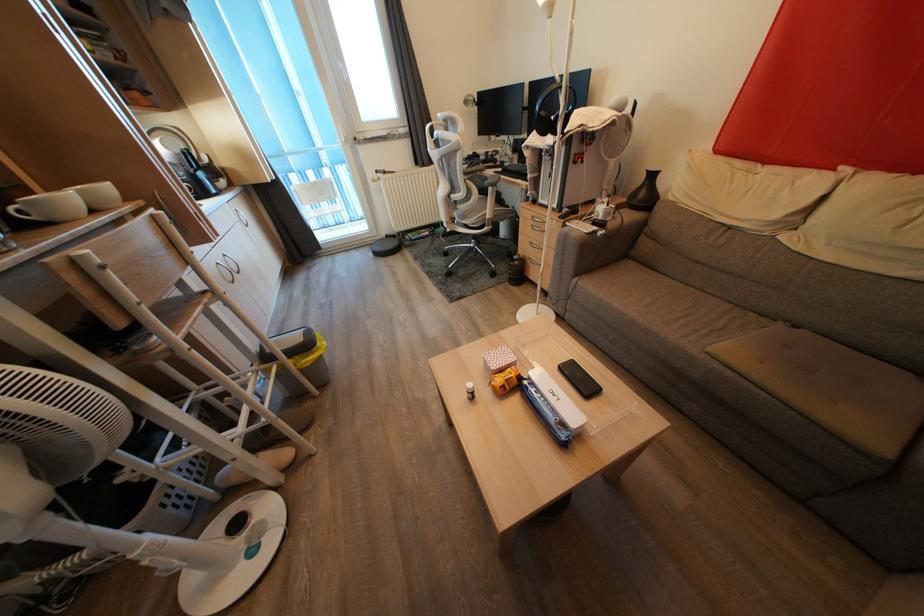
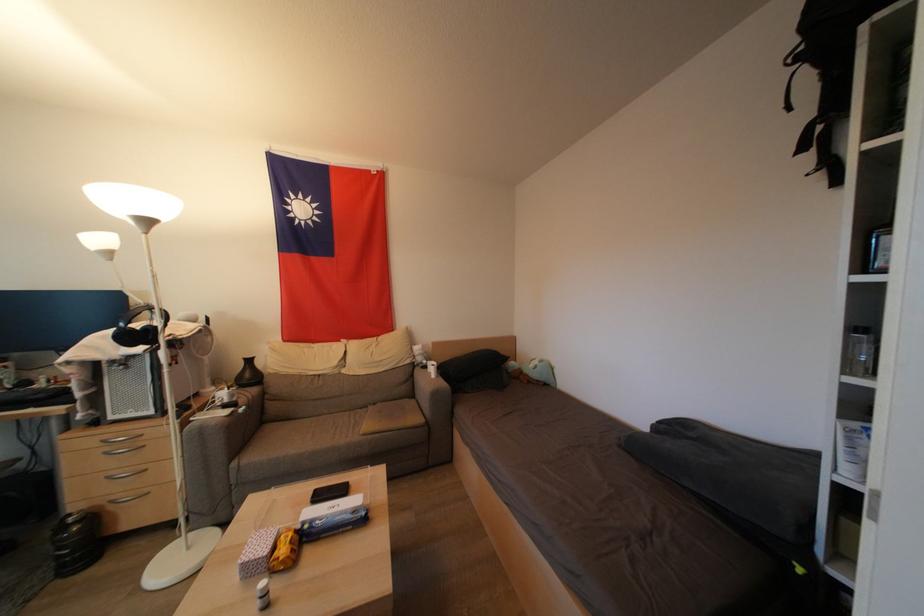
Question: The images are taken continuously from a first-person perspective. In which direction is your viewpoint rotating?

Choices:
 (A) Left
 (B) Right
 (C) Up
 (D) Down

Answer: (B)